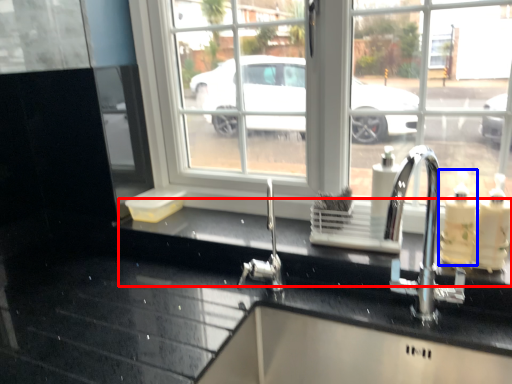
Question: Which of the following is the farthest to the observer, counter top (highlighted by a red box) or soap dispenser (highlighted by a blue box)?

Choices:
 (A) counter top
 (B) soap dispenser

Answer: (B)